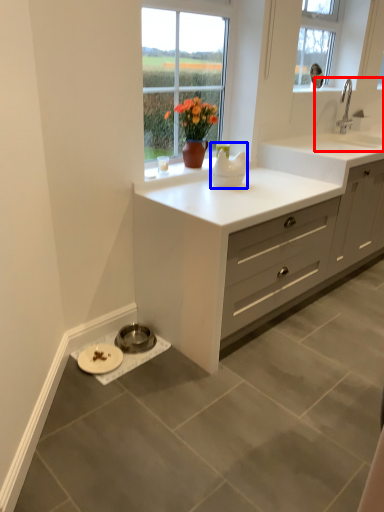
Question: Among these objects, which one is farthest to the camera, sink (highlighted by a red box) or appliance (highlighted by a blue box)?

Choices:
 (A) sink
 (B) appliance

Answer: (A)